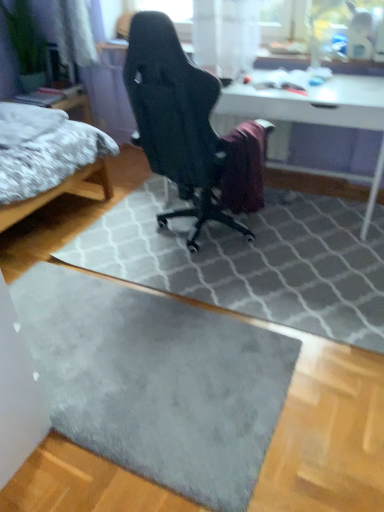
Question: Would you say gray fluffy bed at left contains black mesh chair at center?

Choices:
 (A) yes
 (B) no

Answer: (B)

Question: Does gray fluffy bed at left turn towards black mesh chair at center?

Choices:
 (A) yes
 (B) no

Answer: (B)

Question: Does gray fluffy bed at left have a greater height compared to black mesh chair at center?

Choices:
 (A) no
 (B) yes

Answer: (A)

Question: Is gray fluffy bed at left not close to black mesh chair at center?

Choices:
 (A) yes
 (B) no

Answer: (B)

Question: Is gray fluffy bed at left outside black mesh chair at center?

Choices:
 (A) yes
 (B) no

Answer: (A)

Question: From the image's perspective, would you say gray fluffy bed at left is positioned over black mesh chair at center?

Choices:
 (A) no
 (B) yes

Answer: (A)

Question: Does gray fluffy bed at left appear on the right side of white glossy table at center?

Choices:
 (A) no
 (B) yes

Answer: (A)

Question: Considering the relative sizes of gray fluffy bed at left and white glossy table at center in the image provided, is gray fluffy bed at left bigger than white glossy table at center?

Choices:
 (A) yes
 (B) no

Answer: (A)

Question: Is the position of gray fluffy bed at left less distant than that of white glossy table at center?

Choices:
 (A) yes
 (B) no

Answer: (A)

Question: Does gray fluffy bed at left have a smaller size compared to white glossy table at center?

Choices:
 (A) no
 (B) yes

Answer: (A)

Question: Does gray fluffy bed at left turn towards white glossy table at center?

Choices:
 (A) yes
 (B) no

Answer: (B)

Question: Are gray fluffy bed at left and white glossy table at center located far from each other?

Choices:
 (A) yes
 (B) no

Answer: (A)

Question: Is white glossy table at center taller than gray fluffy bed at left?

Choices:
 (A) yes
 (B) no

Answer: (B)